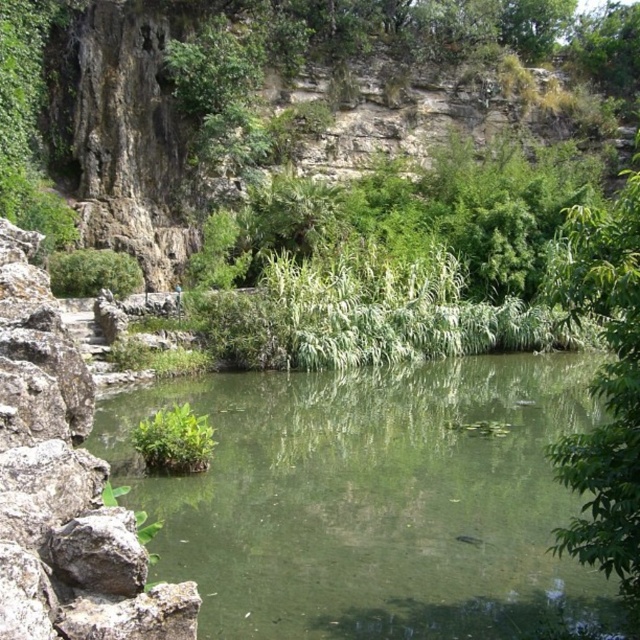
Question: Is green translucent water at center below green leafy tree at right?

Choices:
 (A) yes
 (B) no

Answer: (A)

Question: Is gray rough rock at left thinner than green leafy tree at right?

Choices:
 (A) no
 (B) yes

Answer: (B)

Question: Which of the following is the closest to the observer?

Choices:
 (A) green translucent water at center
 (B) green leafy plant at center

Answer: (A)

Question: Is green translucent water at center to the left of gray rough rock at left from the viewer's perspective?

Choices:
 (A) yes
 (B) no

Answer: (B)

Question: Which point is closer to the camera taking this photo?

Choices:
 (A) (166, 410)
 (B) (632, 515)
 (C) (3, 445)

Answer: (B)

Question: Considering the real-world distances, which object is farthest from the green translucent water at center?

Choices:
 (A) gray rough rock at left
 (B) green leafy tree at right
 (C) green leafy plant at center

Answer: (A)